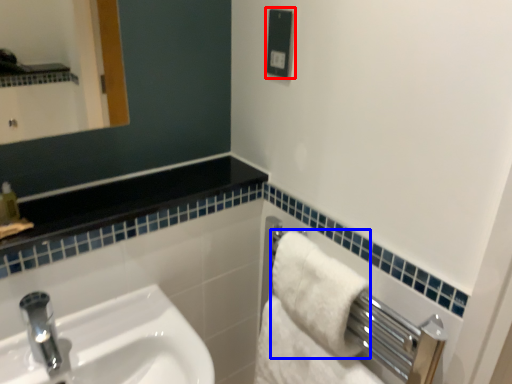
Question: Which object appears farthest to the camera in this image, electric outlet (highlighted by a red box) or bath towel (highlighted by a blue box)?

Choices:
 (A) electric outlet
 (B) bath towel

Answer: (A)